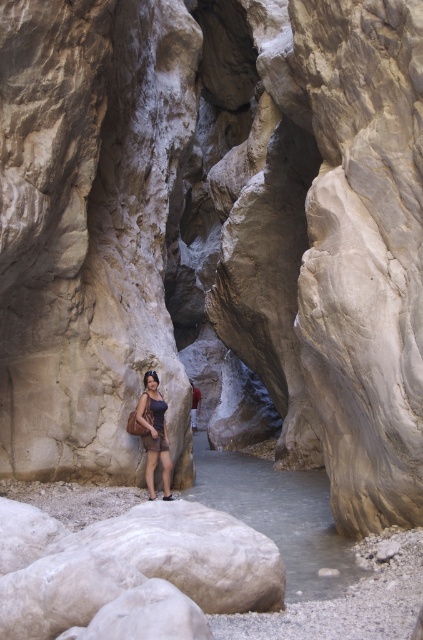
Question: Can you confirm if matte purple dress at center is positioned to the right of red fabric shirt at center?

Choices:
 (A) yes
 (B) no

Answer: (B)

Question: Estimate the real-world distances between objects in this image. Which object is closer to the red fabric shirt at center?

Choices:
 (A) matte purple dress at center
 (B) clear water at center

Answer: (A)

Question: Which of the following is the farthest from the observer?

Choices:
 (A) matte purple dress at center
 (B) red fabric shirt at center

Answer: (B)

Question: Is clear water at center smaller than matte purple dress at center?

Choices:
 (A) no
 (B) yes

Answer: (A)

Question: Does clear water at center have a greater width compared to red fabric shirt at center?

Choices:
 (A) no
 (B) yes

Answer: (B)

Question: Which point is closer to the camera taking this photo?

Choices:
 (A) (191, 385)
 (B) (280, 550)

Answer: (B)